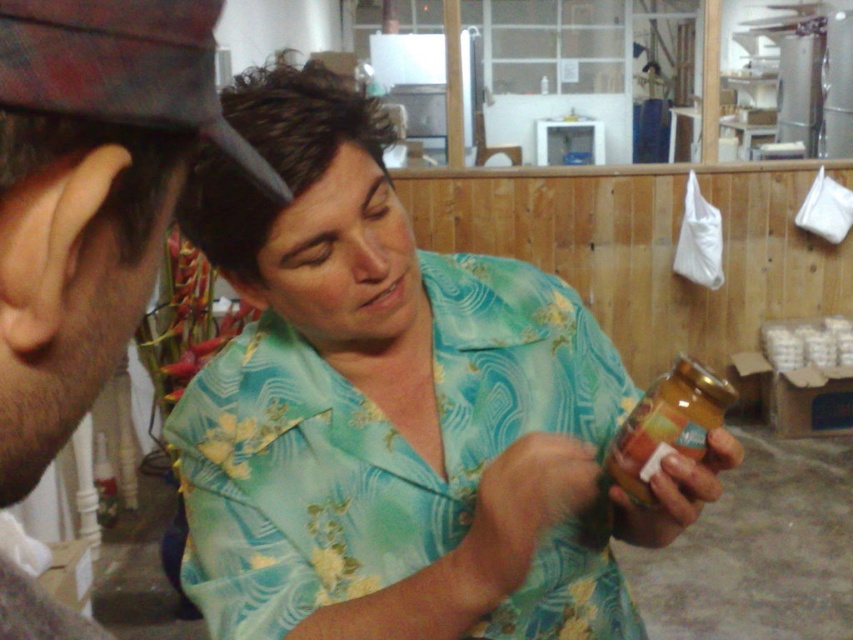
You are standing in the workshop and want to reach the jar held by the person in the light blue shirt with a floral pattern. There are two points marked in the scene. The first point is at coordinates point (343, 211) and the second at point (633, 515). Which point should you move towards to get closer to the jar?

Point (343, 211) is in front of point (633, 515). Therefore, moving towards point (343, 211) would bring you closer to the jar held by the person in the light blue shirt with a floral pattern.

You are a visitor in the workshop and want to place a small decorative item between the matte black comb at upper left and the brown hair at left. Based on their sizes, can you fit it there?

The matte black comb at upper left might be wider than brown hair at left, so there might be enough space to place a small decorative item between them.

You are a hair stylist observing the scene. The client has brown hair at left and wants to use a matte black comb at upper left to style it. Can you reach the comb without moving the client?

The matte black comb at upper left is below the brown hair at left, so you can easily reach it without moving the client.